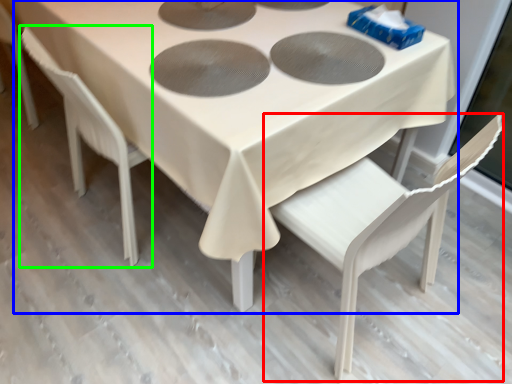
Question: Based on their relative distances, which object is farther from chair (highlighted by a red box)? Choose from table (highlighted by a blue box) and chair (highlighted by a green box).

Choices:
 (A) table
 (B) chair

Answer: (B)